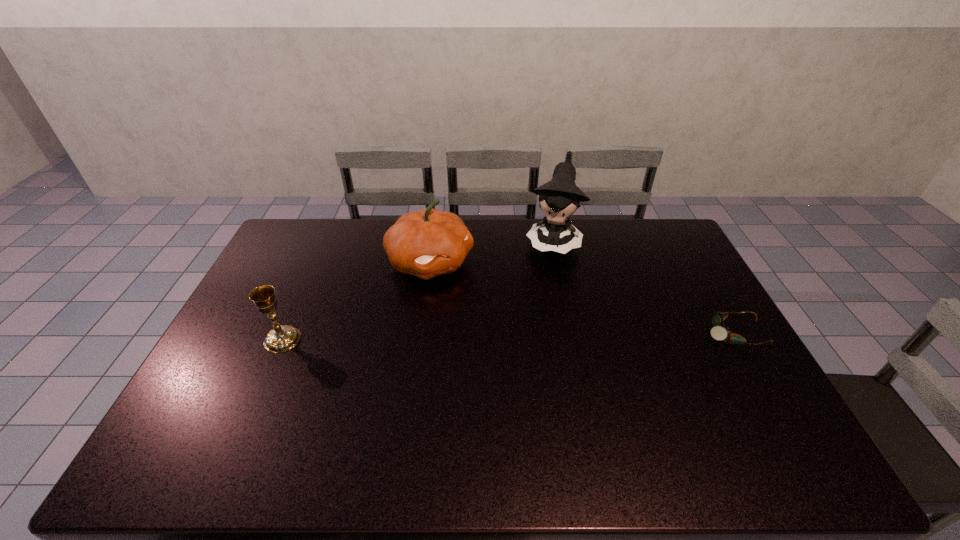
Where is `vacant space located on the front face of the third shortest object`? The height and width of the screenshot is (540, 960). vacant space located on the front face of the third shortest object is located at coordinates (487, 300).

What are the coordinates of `vacant space situated 0.150m on the front face of the third shortest object` in the screenshot? It's located at (493, 304).

The image size is (960, 540). Find the location of `free region located 0.200m at the face of the second object from right to left`. free region located 0.200m at the face of the second object from right to left is located at coordinates (540, 301).

Find the location of a particular element. vacant region located at the face of the second object from right to left is located at coordinates (530, 337).

You are a GUI agent. You are given a task and a screenshot of the screen. Output one action in this format:
    pyautogui.click(x=<x>, y=<y>)
    Task: Click on the vacant area situated 0.160m at the face of the second object from right to left
    
    Given the screenshot: What is the action you would take?
    pyautogui.click(x=541, y=293)

This screenshot has height=540, width=960. What are the coordinates of `pumpkin positioned at the far edge` in the screenshot? It's located at (428, 243).

The width and height of the screenshot is (960, 540). What are the coordinates of `doll present at the far edge` in the screenshot? It's located at (560, 197).

Identify the location of object that is at the left edge. The width and height of the screenshot is (960, 540). pyautogui.click(x=282, y=338).

At what (x,y) coordinates should I click in order to perform the action: click on object that is at the right edge. Please return your answer as a coordinate pair (x, y). Image resolution: width=960 pixels, height=540 pixels. Looking at the image, I should click on (719, 333).

At what (x,y) coordinates should I click in order to perform the action: click on vacant point at the far edge. Please return your answer as a coordinate pair (x, y). This screenshot has height=540, width=960. Looking at the image, I should click on (501, 237).